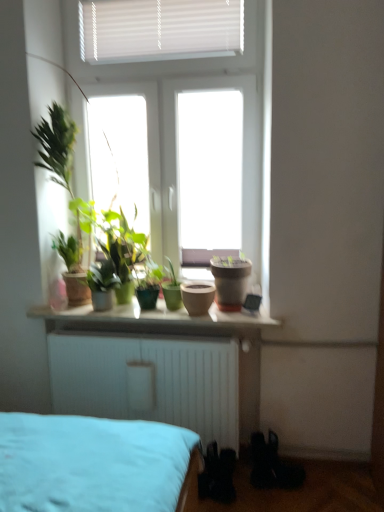
Find the location of a particular element. This screenshot has height=512, width=384. matte brown pot at center, the second flowerpot positioned from the left is located at coordinates (230, 281).

Measure the distance between matte brown pot at center, acting as the first flowerpot starting from the right, and camera.

A distance of 2.17 meters exists between matte brown pot at center, acting as the first flowerpot starting from the right, and camera.

Describe the element at coordinates (151, 320) in the screenshot. The image size is (384, 512). I see `matte ceramic pots at center` at that location.

You are a GUI agent. You are given a task and a screenshot of the screen. Output one action in this format:
    pyautogui.click(x=<x>, y=<y>)
    Task: Click on the green matte plant at center, which ranks as the second houseplant in left-to-right order
    
    Given the screenshot: What is the action you would take?
    pyautogui.click(x=171, y=287)

Image resolution: width=384 pixels, height=512 pixels. What are the coordinates of `green matte plant at center, which ranks as the 1th houseplant in left-to-right order` in the screenshot? It's located at (102, 284).

The height and width of the screenshot is (512, 384). In order to click on matte brown pot at center, acting as the first flowerpot starting from the right in this screenshot , I will do `click(230, 281)`.

Does matte ceramic pots at center have a larger size compared to green matte plant at center, arranged as the 2th houseplant when viewed from the right?

Correct, matte ceramic pots at center is larger in size than green matte plant at center, arranged as the 2th houseplant when viewed from the right.

From the image's perspective, which is below, matte ceramic pots at center or green matte plant at center, which ranks as the 1th houseplant in left-to-right order?

matte ceramic pots at center.

Could you tell me if matte ceramic pots at center is turned towards green matte plant at center, arranged as the 2th houseplant when viewed from the right?

No, matte ceramic pots at center is not aimed at green matte plant at center, arranged as the 2th houseplant when viewed from the right.

Is matte ceramic pots at center positioned behind green matte plant at center, which ranks as the 1th houseplant in left-to-right order?

No, it is in front of green matte plant at center, which ranks as the 1th houseplant in left-to-right order.

Which of these two, green matte plant at center, which ranks as the second houseplant in left-to-right order, or matte brown pot at center, acting as the first flowerpot starting from the right, is thinner?

Thinner between the two is green matte plant at center, which ranks as the second houseplant in left-to-right order.

Is green matte plant at center, the first houseplant from the right, facing towards matte brown pot at center, acting as the first flowerpot starting from the right?

Result: No, green matte plant at center, the first houseplant from the right, is not facing towards matte brown pot at center, acting as the first flowerpot starting from the right.

Between green matte plant at center, the first houseplant from the right, and matte brown pot at center, acting as the first flowerpot starting from the right, which one has less height?

matte brown pot at center, acting as the first flowerpot starting from the right.

Considering the positions of objects green matte plant at center, which ranks as the second houseplant in left-to-right order, and matte brown pot at center, the second flowerpot positioned from the left, in the image provided, who is more to the right, green matte plant at center, which ranks as the second houseplant in left-to-right order, or matte brown pot at center, the second flowerpot positioned from the left,?

From the viewer's perspective, matte brown pot at center, the second flowerpot positioned from the left, appears more on the right side.

Considering the sizes of objects green matte plant at center, arranged as the 2th houseplant when viewed from the right, and matte brown pot at center, acting as the first flowerpot starting from the right, in the image provided, who is bigger, green matte plant at center, arranged as the 2th houseplant when viewed from the right, or matte brown pot at center, acting as the first flowerpot starting from the right,?

With larger size is matte brown pot at center, acting as the first flowerpot starting from the right.

Is green matte plant at center, which ranks as the 1th houseplant in left-to-right order, touching matte brown pot at center, the second flowerpot positioned from the left?

No, green matte plant at center, which ranks as the 1th houseplant in left-to-right order, is not next to matte brown pot at center, the second flowerpot positioned from the left.

Which of these two, green matte plant at center, arranged as the 2th houseplant when viewed from the right, or matte brown pot at center, acting as the first flowerpot starting from the right, stands shorter?

green matte plant at center, arranged as the 2th houseplant when viewed from the right, is shorter.

From the image's perspective, is green matte plant at center, which ranks as the 1th houseplant in left-to-right order, under matte brown pot at center, the second flowerpot positioned from the left?

Yes.

Is matte clay pot at center, which is counted as the 1th flowerpot, starting from the left, situated inside green matte plant at center, the first houseplant from the right, or outside?

matte clay pot at center, which is counted as the 1th flowerpot, starting from the left, lies outside green matte plant at center, the first houseplant from the right.

Based on their sizes in the image, would you say matte clay pot at center, the second flowerpot in the right-to-left sequence, is bigger or smaller than green matte plant at center, the first houseplant from the right?

Clearly, matte clay pot at center, the second flowerpot in the right-to-left sequence, is smaller in size than green matte plant at center, the first houseplant from the right.

Considering the relative sizes of matte clay pot at center, which is counted as the 1th flowerpot, starting from the left, and green matte plant at center, the first houseplant from the right, in the image provided, is matte clay pot at center, which is counted as the 1th flowerpot, starting from the left, shorter than green matte plant at center, the first houseplant from the right,?

Indeed, matte clay pot at center, which is counted as the 1th flowerpot, starting from the left, has a lesser height compared to green matte plant at center, the first houseplant from the right.

From the picture: From the image's perspective, between matte clay pot at center, which is counted as the 1th flowerpot, starting from the left, and green matte plant at center, the first houseplant from the right, who is located below?

matte clay pot at center, which is counted as the 1th flowerpot, starting from the left, is shown below in the image.

In the scene shown: Which of these two, matte ceramic pots at center or matte clay pot at center, which is counted as the 1th flowerpot, starting from the left, is bigger?

matte ceramic pots at center.

Based on the photo, is matte ceramic pots at center spatially inside matte clay pot at center, the second flowerpot in the right-to-left sequence, or outside of it?

matte ceramic pots at center is outside matte clay pot at center, the second flowerpot in the right-to-left sequence.

Based on the photo, is matte ceramic pots at center further to the viewer compared to matte clay pot at center, the second flowerpot in the right-to-left sequence?

No, matte ceramic pots at center is closer to the camera.

Looking at this image, does matte ceramic pots at center appear on the left side of matte clay pot at center, which is counted as the 1th flowerpot, starting from the left?

Correct, you'll find matte ceramic pots at center to the left of matte clay pot at center, which is counted as the 1th flowerpot, starting from the left.

Consider the image. Is green matte plant at center, which ranks as the second houseplant in left-to-right order, positioned before black matte shoe at lower right?

No, green matte plant at center, which ranks as the second houseplant in left-to-right order, is behind black matte shoe at lower right.

Which is behind, point (163, 283) or point (295, 487)?

The point (163, 283) is more distant.

From a real-world perspective, is green matte plant at center, the first houseplant from the right, physically below black matte shoe at lower right?

No, from a real-world perspective, green matte plant at center, the first houseplant from the right, is not below black matte shoe at lower right.

Consider the image. Is green matte plant at center, which ranks as the second houseplant in left-to-right order, located outside black matte shoe at lower right?

Yes.

From a real-world perspective, does green matte plant at center, arranged as the 2th houseplant when viewed from the right, stand above matte ceramic pots at center?

Yes.

Does green matte plant at center, which ranks as the 1th houseplant in left-to-right order, have a greater width compared to matte ceramic pots at center?

In fact, green matte plant at center, which ranks as the 1th houseplant in left-to-right order, might be narrower than matte ceramic pots at center.

From their relative heights in the image, would you say green matte plant at center, which ranks as the 1th houseplant in left-to-right order, is taller or shorter than matte ceramic pots at center?

Clearly, green matte plant at center, which ranks as the 1th houseplant in left-to-right order, is taller compared to matte ceramic pots at center.

Identify the location of counter top on the right of green matte plant at center, arranged as the 2th houseplant when viewed from the right. (151, 320).

Identify the location of the 1st flowerpot below the green matte plant at center, which ranks as the second houseplant in left-to-right order (from the image's perspective). Image resolution: width=384 pixels, height=512 pixels. (230, 281).

From the image, which object appears to be farther from black matte shoe at lower right, green matte plant at center, which ranks as the second houseplant in left-to-right order, or green matte plant at center, which ranks as the 1th houseplant in left-to-right order?

green matte plant at center, which ranks as the 1th houseplant in left-to-right order.

From the image, which object appears to be nearer to black matte shoe at lower right, matte brown pot at center, acting as the first flowerpot starting from the right, or matte ceramic pots at center?

matte brown pot at center, acting as the first flowerpot starting from the right.

When comparing their distances from black matte shoe at lower right, does matte brown pot at center, acting as the first flowerpot starting from the right, or green matte plant at center, the first houseplant from the right, seem further?

Among the two, green matte plant at center, the first houseplant from the right, is located further to black matte shoe at lower right.

From the image, which object appears to be nearer to matte brown pot at center, the second flowerpot positioned from the left, black matte shoe at lower right or green matte plant at center, which ranks as the second houseplant in left-to-right order?

green matte plant at center, which ranks as the second houseplant in left-to-right order, lies closer to matte brown pot at center, the second flowerpot positioned from the left, than the other object.

Estimate the real-world distances between objects in this image. Which object is closer to matte brown pot at center, acting as the first flowerpot starting from the right, green matte plant at center, arranged as the 2th houseplant when viewed from the right, or black matte shoe at lower right?

green matte plant at center, arranged as the 2th houseplant when viewed from the right, is closer to matte brown pot at center, acting as the first flowerpot starting from the right.

Which object lies further to the anchor point matte ceramic pots at center, green matte plant at center, which ranks as the 1th houseplant in left-to-right order, or matte brown pot at center, acting as the first flowerpot starting from the right?

Based on the image, matte brown pot at center, acting as the first flowerpot starting from the right, appears to be further to matte ceramic pots at center.

Estimate the real-world distances between objects in this image. Which object is further from matte brown pot at center, the second flowerpot positioned from the left, matte ceramic pots at center or black matte shoe at lower right?

Based on the image, black matte shoe at lower right appears to be further to matte brown pot at center, the second flowerpot positioned from the left.

Considering their positions, is green matte plant at center, which ranks as the 1th houseplant in left-to-right order, positioned closer to green matte plant at center, the first houseplant from the right, than black matte shoe at lower right?

green matte plant at center, which ranks as the 1th houseplant in left-to-right order.

The width and height of the screenshot is (384, 512). Identify the location of counter top situated between green matte plant at center, arranged as the 2th houseplant when viewed from the right, and matte brown pot at center, the second flowerpot positioned from the left, from left to right. (151, 320).

Find the location of a particular element. The width and height of the screenshot is (384, 512). flowerpot between green matte plant at center, arranged as the 2th houseplant when viewed from the right, and black matte shoe at lower right, in the vertical direction is located at coordinates (197, 297).

This screenshot has width=384, height=512. What are the coordinates of `houseplant located between green matte plant at center, which ranks as the 1th houseplant in left-to-right order, and matte brown pot at center, acting as the first flowerpot starting from the right, in the left-right direction` in the screenshot? It's located at [171, 287].

At what (x,y) coordinates should I click in order to perform the action: click on counter top between matte clay pot at center, the second flowerpot in the right-to-left sequence, and black matte shoe at lower right in the up-down direction. Please return your answer as a coordinate pair (x, y). This screenshot has height=512, width=384. Looking at the image, I should click on (151, 320).